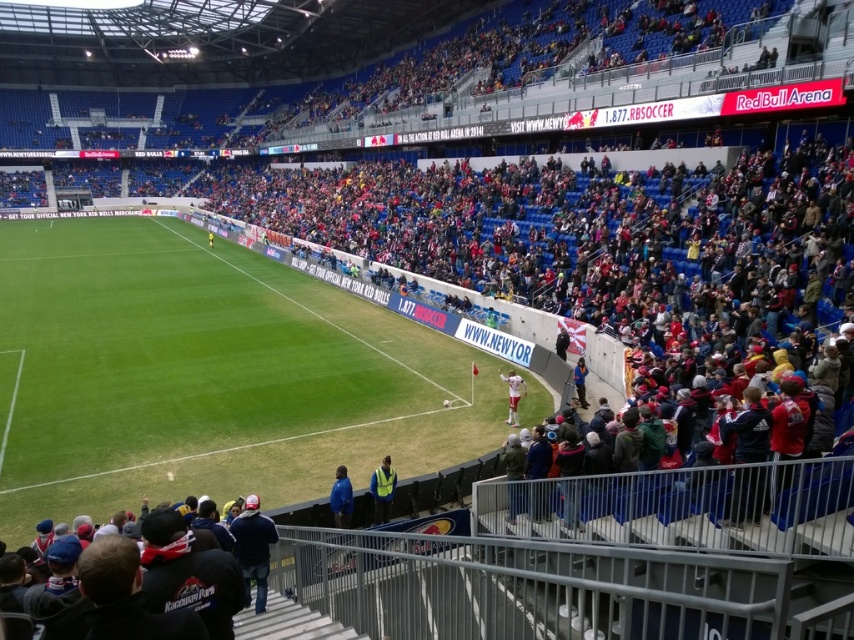
Question: Which point appears farthest from the camera in this image?

Choices:
 (A) (588, 404)
 (B) (349, 502)
 (C) (174, 541)

Answer: (A)

Question: Is white fabric shirt at lower right bigger than blue fabric jacket at right?

Choices:
 (A) no
 (B) yes

Answer: (B)

Question: Which point is closer to the camera taking this photo?

Choices:
 (A) (191, 570)
 (B) (250, 413)
 (C) (335, 508)

Answer: (A)

Question: Which of the following is the closest to the observer?

Choices:
 (A) (574, 376)
 (B) (161, 561)

Answer: (B)

Question: Can you confirm if dark blue jacket at lower center is positioned to the left of dark blue jeans at lower center?

Choices:
 (A) no
 (B) yes

Answer: (A)

Question: Is green grass football field at center wider than yellow reflective vest at center?

Choices:
 (A) no
 (B) yes

Answer: (B)